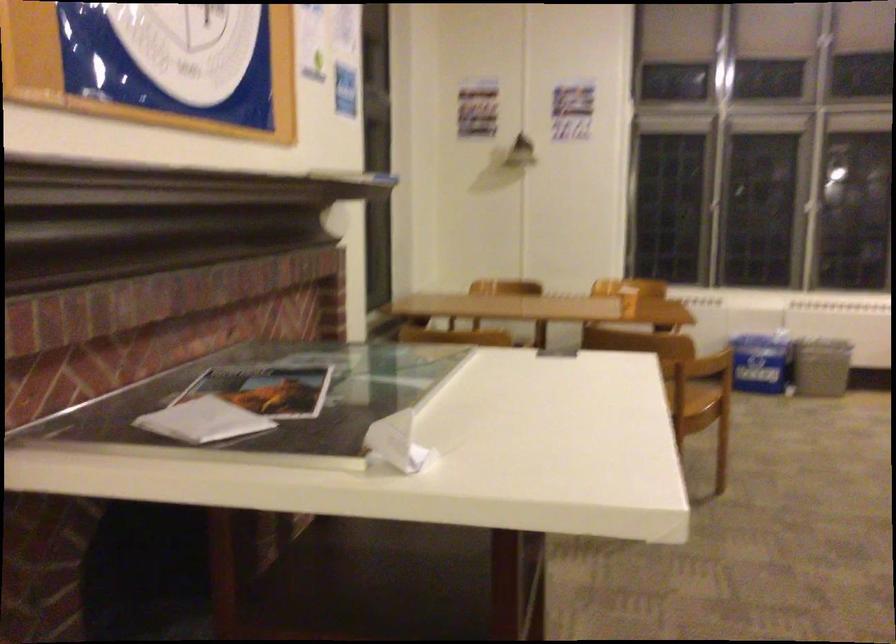
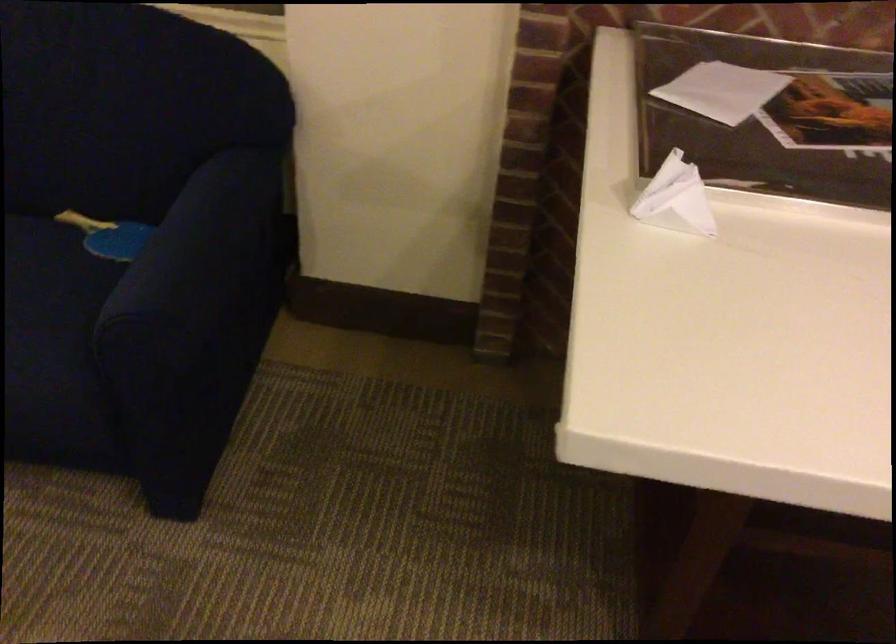
The point at (421,448) is marked in the first image. Where is the corresponding point in the second image?

(675, 199)